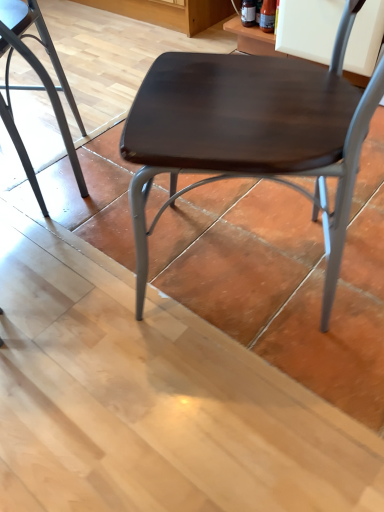
Question: From the image's perspective, is dark wood/matte chair at center, acting as the second chair starting from the left, under metallic gray chair at lower left, which ranks as the second chair in right-to-left order?

Choices:
 (A) no
 (B) yes

Answer: (B)

Question: Is dark wood/matte chair at center, acting as the second chair starting from the left, facing towards metallic gray chair at lower left, which ranks as the second chair in right-to-left order?

Choices:
 (A) no
 (B) yes

Answer: (B)

Question: Does dark wood/matte chair at center, placed as the 1th chair when sorted from right to left, have a lesser height compared to metallic gray chair at lower left, which appears as the 1th chair when viewed from the left?

Choices:
 (A) yes
 (B) no

Answer: (B)

Question: Is dark wood/matte chair at center, placed as the 1th chair when sorted from right to left, further to camera compared to metallic gray chair at lower left, which appears as the 1th chair when viewed from the left?

Choices:
 (A) no
 (B) yes

Answer: (A)

Question: From a real-world perspective, is dark wood/matte chair at center, acting as the second chair starting from the left, over metallic gray chair at lower left, which ranks as the second chair in right-to-left order?

Choices:
 (A) no
 (B) yes

Answer: (B)

Question: Would you say dark wood/matte chair at center, placed as the 1th chair when sorted from right to left, contains metallic gray chair at lower left, which ranks as the second chair in right-to-left order?

Choices:
 (A) yes
 (B) no

Answer: (B)

Question: Is metallic gray chair at lower left, which ranks as the second chair in right-to-left order, aimed at dark wood/matte chair at center, acting as the second chair starting from the left?

Choices:
 (A) no
 (B) yes

Answer: (A)

Question: Is metallic gray chair at lower left, which appears as the 1th chair when viewed from the left, positioned before dark wood/matte chair at center, placed as the 1th chair when sorted from right to left?

Choices:
 (A) no
 (B) yes

Answer: (A)

Question: Is metallic gray chair at lower left, which ranks as the second chair in right-to-left order, shorter than dark wood/matte chair at center, acting as the second chair starting from the left?

Choices:
 (A) no
 (B) yes

Answer: (B)

Question: Does metallic gray chair at lower left, which appears as the 1th chair when viewed from the left, have a lesser width compared to dark wood/matte chair at center, placed as the 1th chair when sorted from right to left?

Choices:
 (A) yes
 (B) no

Answer: (A)

Question: From a real-world perspective, is metallic gray chair at lower left, which ranks as the second chair in right-to-left order, on top of dark wood/matte chair at center, acting as the second chair starting from the left?

Choices:
 (A) yes
 (B) no

Answer: (B)

Question: Does metallic gray chair at lower left, which appears as the 1th chair when viewed from the left, have a larger size compared to dark wood/matte chair at center, acting as the second chair starting from the left?

Choices:
 (A) no
 (B) yes

Answer: (A)

Question: Does point (331, 159) appear closer or farther from the camera than point (8, 62)?

Choices:
 (A) farther
 (B) closer

Answer: (B)